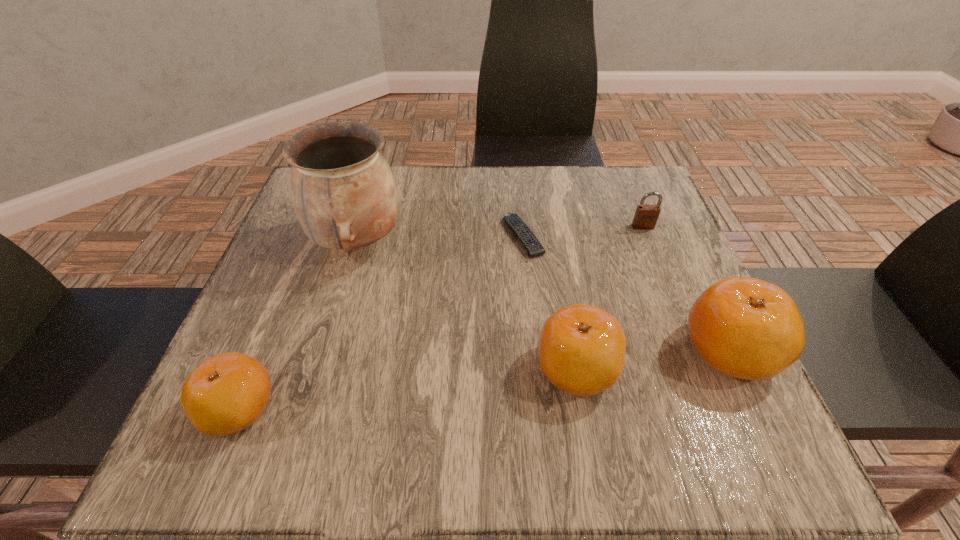
Point out which clementine is positioned as the nearest to the leftmost clementine. Please provide its 2D coordinates. Your answer should be formatted as a tuple, i.e. [(x, y)], where the tuple contains the x and y coordinates of a point satisfying the conditions above.

[(582, 348)]